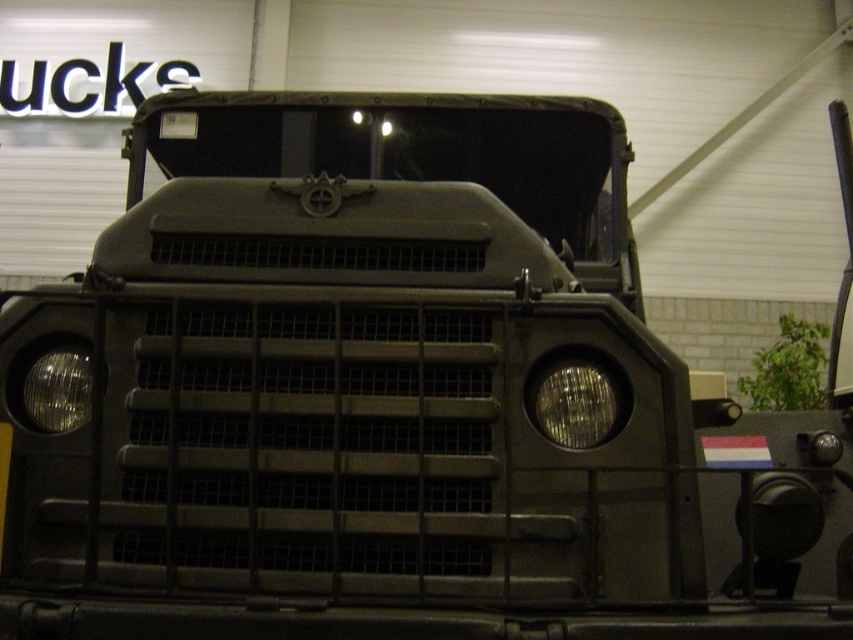
You are a military engineer inspecting the front of the vehicle. You need to locate the matte black headlight at right. Where is it positioned relative to the vehicle?

The matte black headlight at right is positioned at point 0.634 on the x axis and 0.675 on the y axis relative to the vehicle.